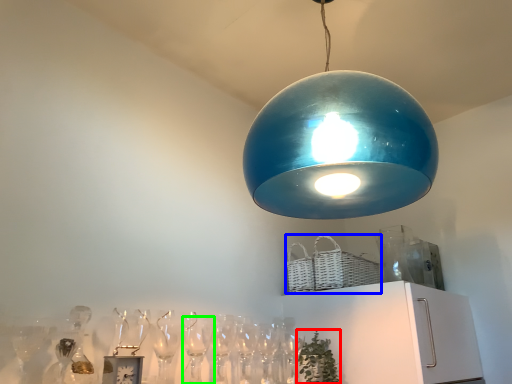
Question: Which object is positioned farthest from plant (highlighted by a red box)? Select from basket (highlighted by a blue box) and wine glass (highlighted by a green box).

Choices:
 (A) basket
 (B) wine glass

Answer: (B)